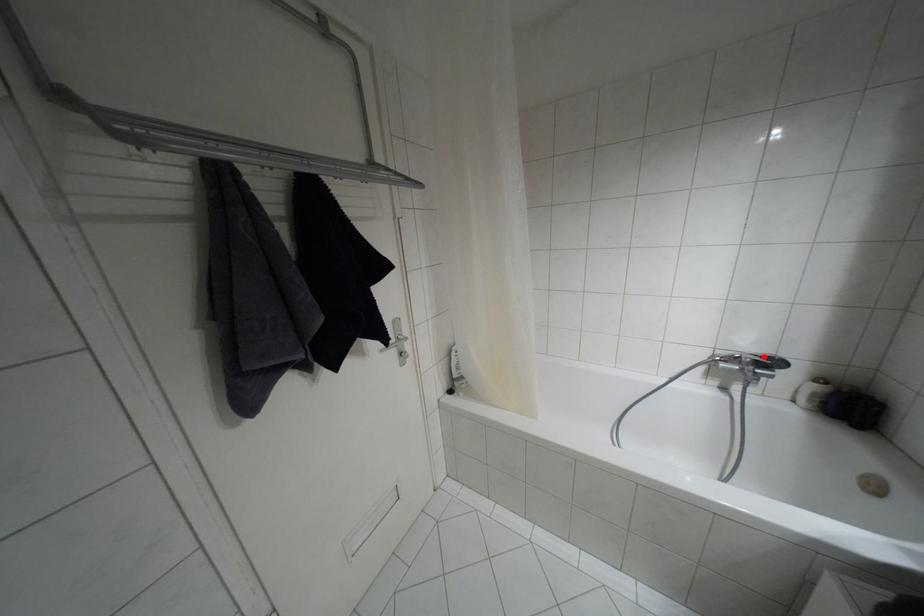
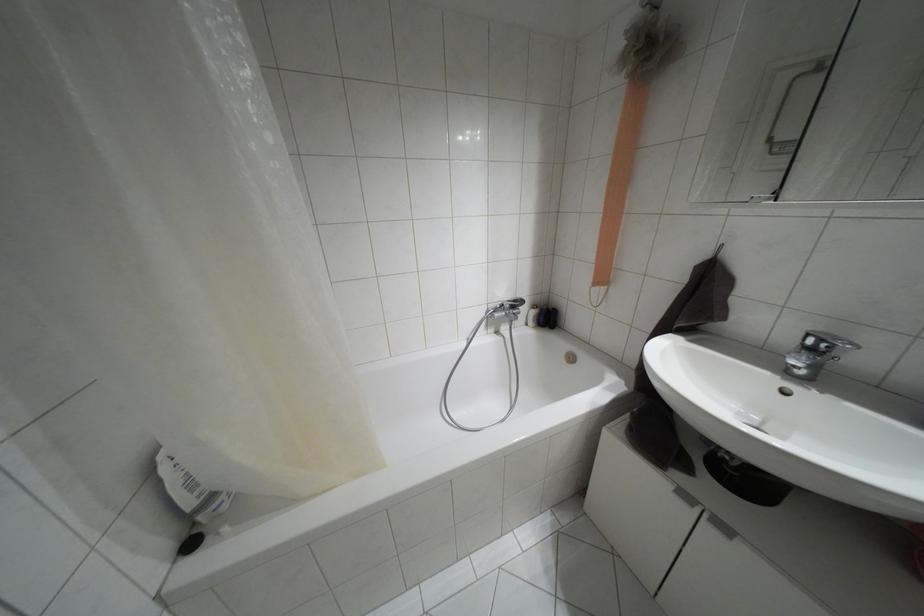
Find the pixel in the second image that matches the highlighted location in the first image.

(514, 301)